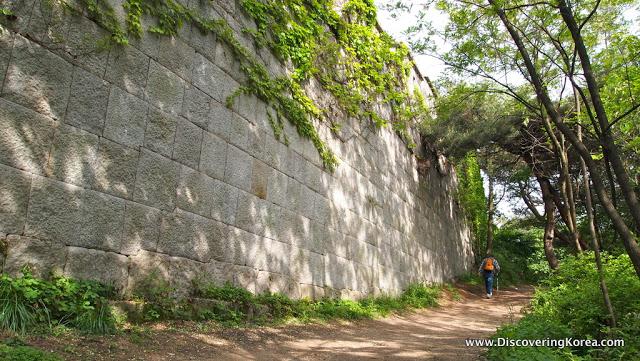
Find the location of a particular element. This screenshot has width=640, height=361. ivy on wall is located at coordinates (355, 99).